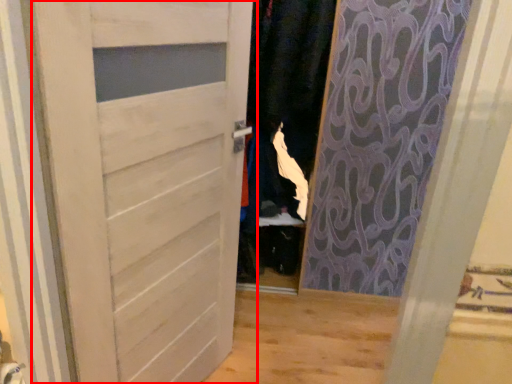
Question: From the image's perspective, what is the correct spatial relationship of door (annotated by the red box) in relation to clothing?

Choices:
 (A) above
 (B) below

Answer: (B)